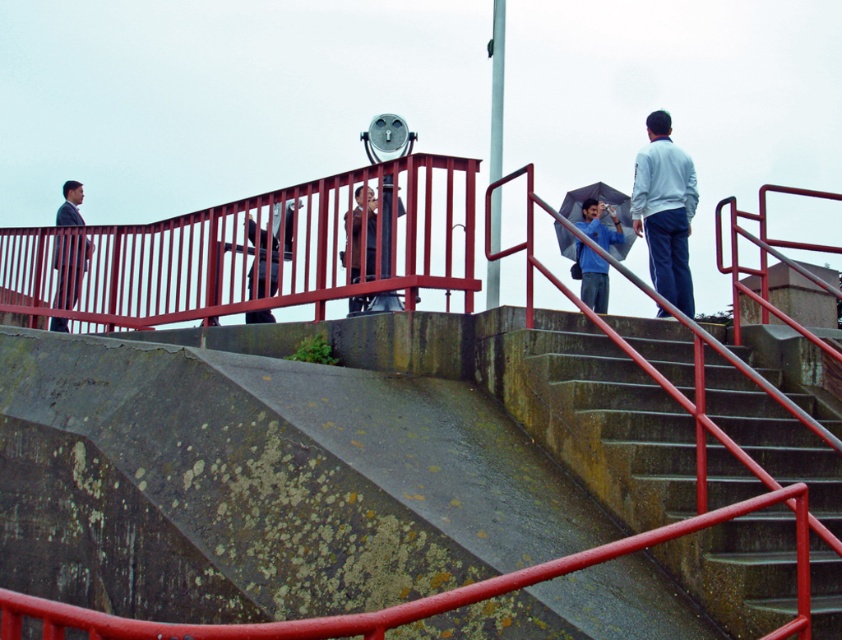
Which is above, light blue fabric jacket at upper right or matte black jacket at center?

light blue fabric jacket at upper right

Locate an element on the screen. light blue fabric jacket at upper right is located at coordinates (665, 211).

In the scene shown: Does light blue fabric jacket at upper right appear on the left side of transparent plastic umbrella at upper right?

Correct, you'll find light blue fabric jacket at upper right to the left of transparent plastic umbrella at upper right.

In order to click on light blue fabric jacket at upper right in this screenshot , I will do `click(665, 211)`.

Who is more forward, (678, 237) or (590, 196)?

Point (678, 237) is in front.

You are a GUI agent. You are given a task and a screenshot of the screen. Output one action in this format:
    pyautogui.click(x=<x>, y=<y>)
    Task: Click on the light blue fabric jacket at upper right
    Image resolution: width=842 pixels, height=640 pixels.
    Given the screenshot: What is the action you would take?
    pyautogui.click(x=665, y=211)

What do you see at coordinates (592, 276) in the screenshot? I see `blue fabric umbrella at upper right` at bounding box center [592, 276].

Does blue fabric umbrella at upper right lie behind transparent plastic umbrella at upper right?

No.

You are a GUI agent. You are given a task and a screenshot of the screen. Output one action in this format:
    pyautogui.click(x=<x>, y=<y>)
    Task: Click on the blue fabric umbrella at upper right
    Image resolution: width=842 pixels, height=640 pixels.
    Given the screenshot: What is the action you would take?
    pyautogui.click(x=592, y=276)